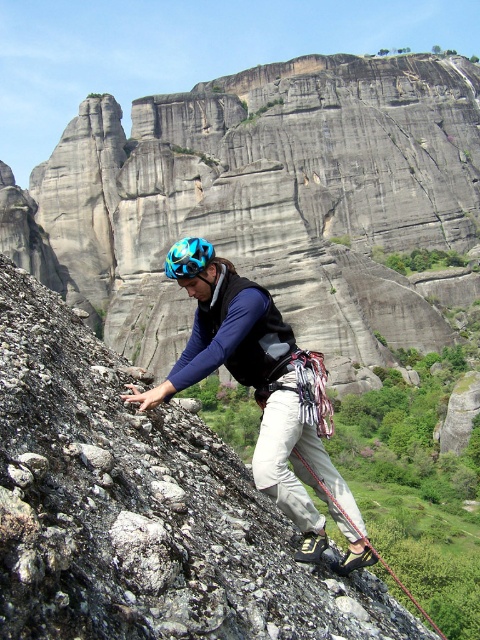
You are a safety inspector reviewing the climber in the image. You notice two helmets labeled as blue matte helmet at center and shiny blue helmet at center. According to the safety protocol, helmets must be placed above the climber to prevent accidental falls. Which helmet violates this rule?

The blue matte helmet at center violates the safety rule because it is located below the shiny blue helmet at center, which means it is not positioned above the climber as required.

You are a safety inspector reviewing the climber in the image. You notice the matte gray climbing harness at center and the blue matte helmet at center. Which object is positioned to the right of the other?

The matte gray climbing harness at center is to the right of the blue matte helmet at center.

Looking at this image, you are a safety inspector checking the gear of a climber. You notice the climber has a matte gray climbing harness at center and a shiny blue helmet at center. Which piece of gear is bigger in size?

The matte gray climbing harness at center is larger in size than the shiny blue helmet at center.